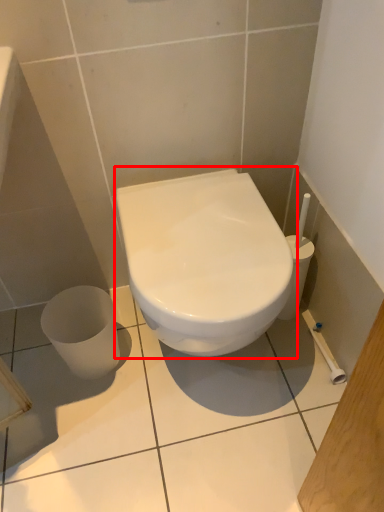
Question: Observing the image, what is the correct spatial positioning of toilet (annotated by the red box) in reference to ceramic tile?

Choices:
 (A) left
 (B) right

Answer: (B)